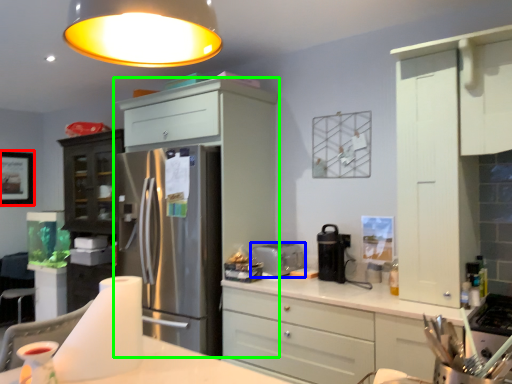
Question: Which object is positioned closest to picture frame (highlighted by a red box)? Select from toaster (highlighted by a blue box) and cabinetry (highlighted by a green box).

Choices:
 (A) toaster
 (B) cabinetry

Answer: (B)